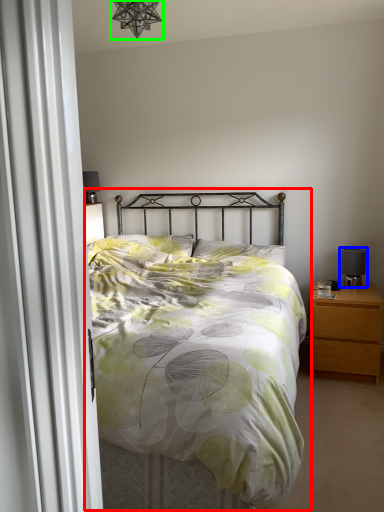
Question: Which object is positioned closest to bed (highlighted by a red box)? Select from table lamp (highlighted by a blue box) and light fixture (highlighted by a green box).

Choices:
 (A) table lamp
 (B) light fixture

Answer: (A)